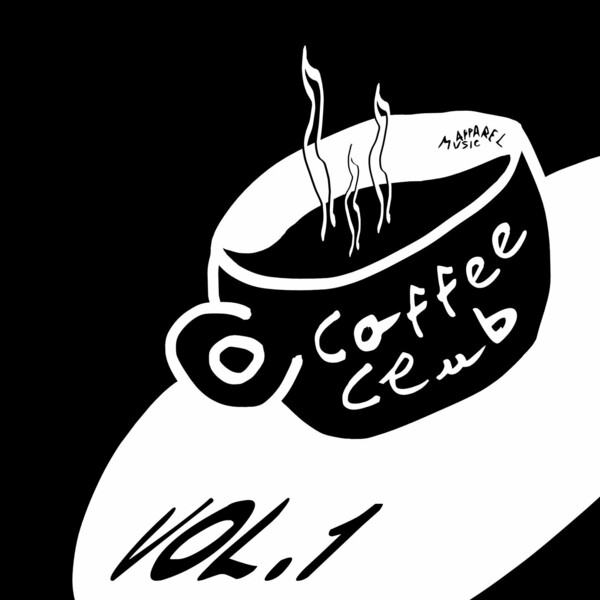
In order to click on white border around handle in this screenshot , I will do `click(174, 359)`.